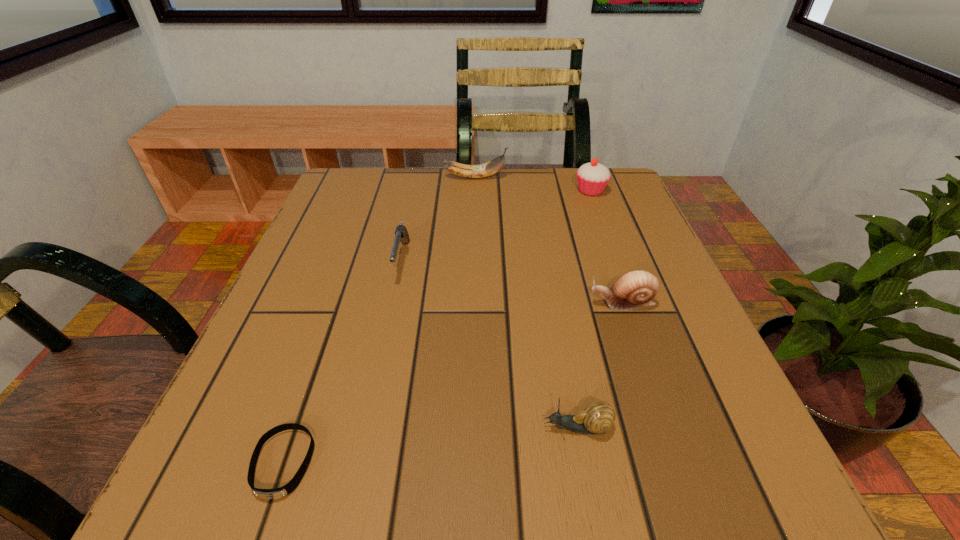
Identify the location of the shortest object. (269, 494).

Identify the location of vacant region located 0.150m at the stem of the banana. (565, 178).

You are a GUI agent. You are given a task and a screenshot of the screen. Output one action in this format:
    pyautogui.click(x=<x>, y=<y>)
    Task: Click on the vacant space located on the left of the second farthest object
    This screenshot has height=540, width=960.
    Given the screenshot: What is the action you would take?
    pyautogui.click(x=549, y=191)

I want to click on vacant area situated on the front-facing side of the third nearest object, so click(x=543, y=303).

You are a GUI agent. You are given a task and a screenshot of the screen. Output one action in this format:
    pyautogui.click(x=<x>, y=<y>)
    Task: Click on the vacant area situated on the front-facing side of the third nearest object
    Image resolution: width=960 pixels, height=540 pixels.
    Given the screenshot: What is the action you would take?
    pyautogui.click(x=432, y=303)

I want to click on free space located 0.140m on the front-facing side of the third nearest object, so click(510, 303).

Identify the location of vacant space located 0.230m aiming along the barrel of the fourth nearest object. (374, 390).

Where is `vacant space located on the front-facing side of the nearer escargot`? This screenshot has height=540, width=960. vacant space located on the front-facing side of the nearer escargot is located at coordinates (279, 428).

The image size is (960, 540). Find the location of `vacant point located on the front-facing side of the nearer escargot`. vacant point located on the front-facing side of the nearer escargot is located at coordinates (331, 428).

Locate an element on the screen. The height and width of the screenshot is (540, 960). blank space located on the front-facing side of the nearer escargot is located at coordinates (484, 428).